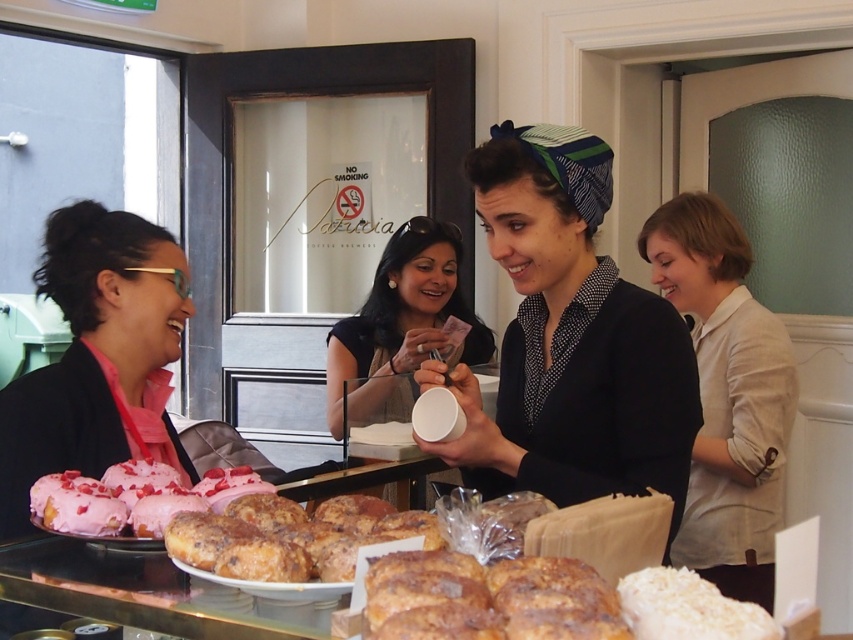
Question: Which object appears farthest from the camera in this image?

Choices:
 (A) pink matte donuts at lower left
 (B) light beige shirt at right
 (C) white coconut-coated donut at center

Answer: (B)

Question: Is matte white cup at center positioned at the back of white coconut-coated donut at center?

Choices:
 (A) no
 (B) yes

Answer: (B)

Question: Which point is farther from the camera taking this photo?

Choices:
 (A) (360, 339)
 (B) (694, 513)
 (C) (425, 538)

Answer: (A)

Question: Can you confirm if polka dot blouse at center is positioned below light beige shirt at right?

Choices:
 (A) yes
 (B) no

Answer: (B)

Question: Which point is farther to the camera?

Choices:
 (A) matte white cup at center
 (B) cinnamon-sugar donuts at lower center
 (C) white coconut-coated donut at center

Answer: (A)

Question: Considering the relative positions of pink matte donuts at lower left and white coconut-coated donut at center in the image provided, where is pink matte donuts at lower left located with respect to white coconut-coated donut at center?

Choices:
 (A) below
 (B) above

Answer: (B)